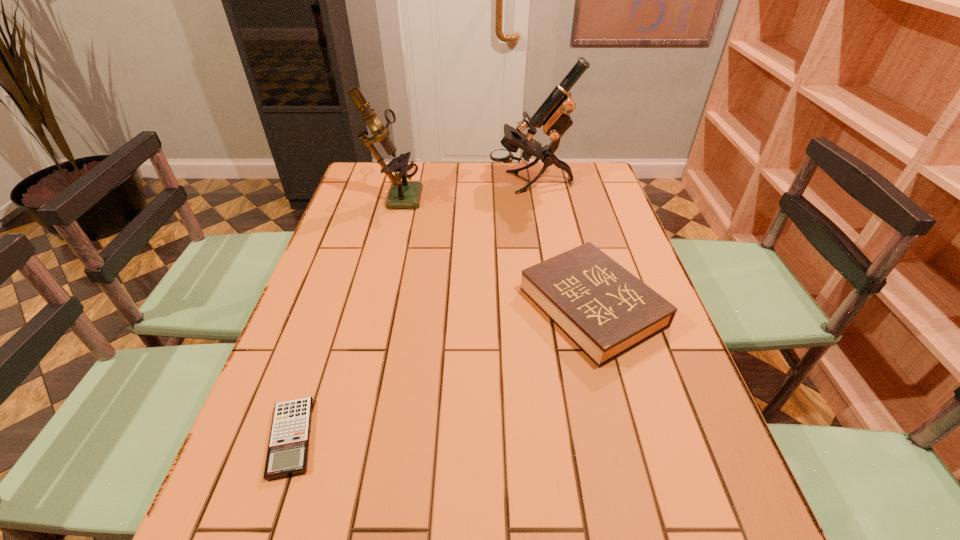
This screenshot has width=960, height=540. In order to click on the right microscope in this screenshot , I will do `click(553, 115)`.

Where is `the left microscope`? The height and width of the screenshot is (540, 960). the left microscope is located at coordinates (403, 194).

The image size is (960, 540). In order to click on hardback book in this screenshot , I will do `click(605, 310)`.

You are a GUI agent. You are given a task and a screenshot of the screen. Output one action in this format:
    pyautogui.click(x=<x>, y=<y>)
    Task: Click on the third farthest object
    Image resolution: width=960 pixels, height=540 pixels.
    Given the screenshot: What is the action you would take?
    pyautogui.click(x=605, y=310)

What are the coordinates of `calculator` in the screenshot? It's located at (288, 448).

Locate an element on the screen. The image size is (960, 540). the nearest object is located at coordinates (288, 448).

What are the coordinates of `free space located through the eyepiece of the right microscope` in the screenshot? It's located at [x=421, y=183].

Where is `vacant area located through the eyepiece of the right microscope`? The width and height of the screenshot is (960, 540). vacant area located through the eyepiece of the right microscope is located at coordinates (421, 183).

Locate an element on the screen. vacant position located through the eyepiece of the right microscope is located at coordinates (404, 183).

At what (x,y) coordinates should I click in order to perform the action: click on vacant region located 0.250m at the eyepiece of the left microscope. Please return your answer as a coordinate pair (x, y). Image resolution: width=960 pixels, height=540 pixels. Looking at the image, I should click on (495, 195).